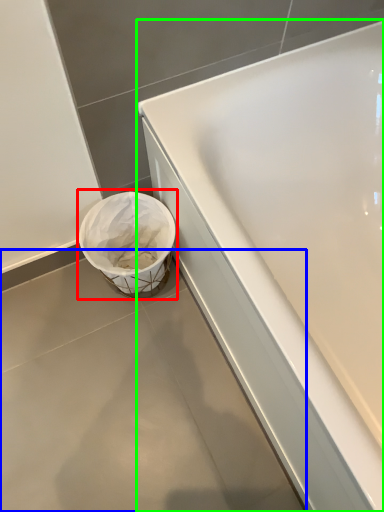
Question: Which is farther away from waste container (highlighted by a red box)? concrete (highlighted by a blue box) or bathtub (highlighted by a green box)?

Choices:
 (A) concrete
 (B) bathtub

Answer: (B)